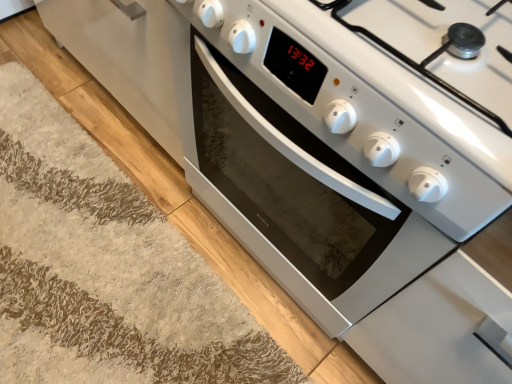
What is the approximate width of white shaggy rug at lower left?

It is 22.99 inches.

The image size is (512, 384). What do you see at coordinates (105, 269) in the screenshot?
I see `white shaggy rug at lower left` at bounding box center [105, 269].

Image resolution: width=512 pixels, height=384 pixels. I want to click on white shaggy rug at lower left, so pos(105,269).

What is the approximate height of white shaggy rug at lower left?

white shaggy rug at lower left is 4.70 centimeters tall.

You are a GUI agent. You are given a task and a screenshot of the screen. Output one action in this format:
    pyautogui.click(x=<x>, y=<y>)
    Task: Click on the white glossy oven at center
    Image resolution: width=512 pixels, height=384 pixels.
    Given the screenshot: What is the action you would take?
    pyautogui.click(x=360, y=186)

What do you see at coordinates (360, 186) in the screenshot? I see `white glossy oven at center` at bounding box center [360, 186].

The height and width of the screenshot is (384, 512). I want to click on white shaggy rug at lower left, so click(x=105, y=269).

Is white glossy oven at center to the right of white shaggy rug at lower left from the viewer's perspective?

Indeed, white glossy oven at center is positioned on the right side of white shaggy rug at lower left.

Consider the image. Considering the relative positions of white glossy oven at center and white shaggy rug at lower left in the image provided, is white glossy oven at center behind white shaggy rug at lower left?

No, white glossy oven at center is closer to the camera.

Consider the image. Which is nearer, (225, 182) or (50, 191)?

Clearly, point (225, 182) is closer to the camera than point (50, 191).

From the image's perspective, is white glossy oven at center on top of white shaggy rug at lower left?

Yes.

From a real-world perspective, is white glossy oven at center physically above white shaggy rug at lower left?

Yes, from a real-world perspective, white glossy oven at center is on top of white shaggy rug at lower left.

Is white glossy oven at center wider than white shaggy rug at lower left?

Correct, the width of white glossy oven at center exceeds that of white shaggy rug at lower left.

Does white glossy oven at center have a lesser height compared to white shaggy rug at lower left?

In fact, white glossy oven at center may be taller than white shaggy rug at lower left.

Who is bigger, white glossy oven at center or white shaggy rug at lower left?

Bigger between the two is white glossy oven at center.

Is white glossy oven at center inside the boundaries of white shaggy rug at lower left, or outside?

white glossy oven at center is located beyond the bounds of white shaggy rug at lower left.

Is white glossy oven at center touching white shaggy rug at lower left?

No, white glossy oven at center is not in contact with white shaggy rug at lower left.

Could you tell me if white glossy oven at center is turned towards white shaggy rug at lower left?

Yes, white glossy oven at center faces towards white shaggy rug at lower left.

Where is `oven in front of the white shaggy rug at lower left`? Image resolution: width=512 pixels, height=384 pixels. oven in front of the white shaggy rug at lower left is located at coordinates (360, 186).

Is white shaggy rug at lower left to the right of white glossy oven at center from the viewer's perspective?

No, white shaggy rug at lower left is not to the right of white glossy oven at center.

Considering the positions of objects white shaggy rug at lower left and white glossy oven at center in the image provided, who is behind, white shaggy rug at lower left or white glossy oven at center?

white shaggy rug at lower left is further from the camera.

Is point (113, 309) closer to viewer compared to point (498, 185)?

No.

From the image's perspective, which one is positioned lower, white shaggy rug at lower left or white glossy oven at center?

white shaggy rug at lower left.

From a real-world perspective, who is located lower, white shaggy rug at lower left or white glossy oven at center?

From a 3D spatial view, white shaggy rug at lower left is below.

Is white shaggy rug at lower left wider or thinner than white glossy oven at center?

Clearly, white shaggy rug at lower left has less width compared to white glossy oven at center.

Does white shaggy rug at lower left have a greater height compared to white glossy oven at center?

No.

Who is smaller, white shaggy rug at lower left or white glossy oven at center?

white shaggy rug at lower left.

Is white shaggy rug at lower left situated inside white glossy oven at center or outside?

white shaggy rug at lower left is spatially situated outside white glossy oven at center.

Is white shaggy rug at lower left directly adjacent to white glossy oven at center?

No, white shaggy rug at lower left is not beside white glossy oven at center.

Is white shaggy rug at lower left oriented towards white glossy oven at center?

No, white shaggy rug at lower left does not turn towards white glossy oven at center.

In the image, there is a white glossy oven at center. In order to click on doormat below it (from a real-world perspective) in this screenshot , I will do `click(105, 269)`.

Locate an element on the screen. doormat that appears on the left of white glossy oven at center is located at coordinates (105, 269).

The width and height of the screenshot is (512, 384). I want to click on oven above the white shaggy rug at lower left (from a real-world perspective), so click(x=360, y=186).